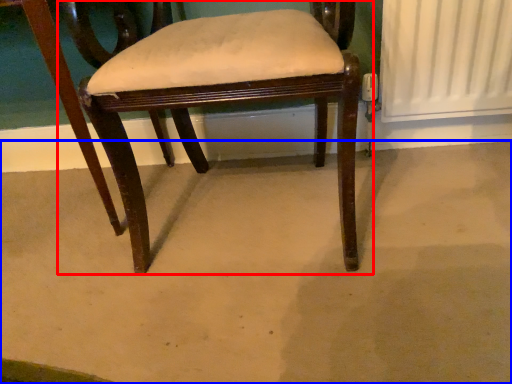
Question: Which point is closer to the camera, chair (highlighted by a red box) or concrete (highlighted by a blue box)?

Choices:
 (A) chair
 (B) concrete

Answer: (B)